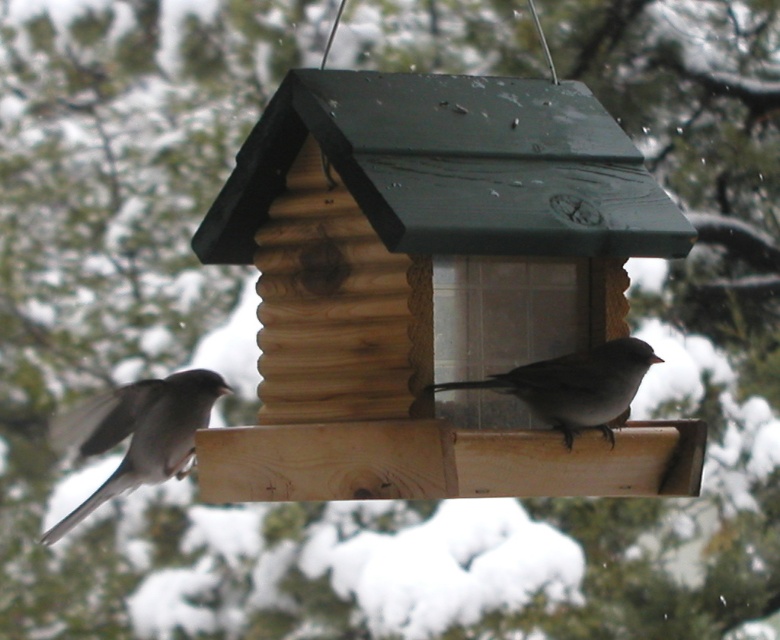
Which is below, gray matte sparrow at left or gray matte sparrow at center?

Positioned lower is gray matte sparrow at left.

You are a GUI agent. You are given a task and a screenshot of the screen. Output one action in this format:
    pyautogui.click(x=<x>, y=<y>)
    Task: Click on the gray matte sparrow at left
    Image resolution: width=780 pixels, height=640 pixels.
    Given the screenshot: What is the action you would take?
    pyautogui.click(x=137, y=433)

Locate an element on the screen. gray matte sparrow at left is located at coordinates (137, 433).